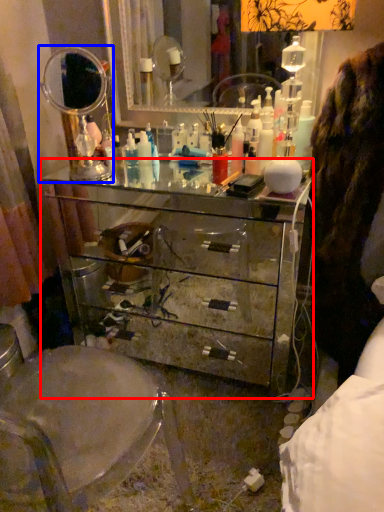
Question: Which object appears closest to the camera in this image, chest of drawers (highlighted by a red box) or mirror (highlighted by a blue box)?

Choices:
 (A) chest of drawers
 (B) mirror

Answer: (A)